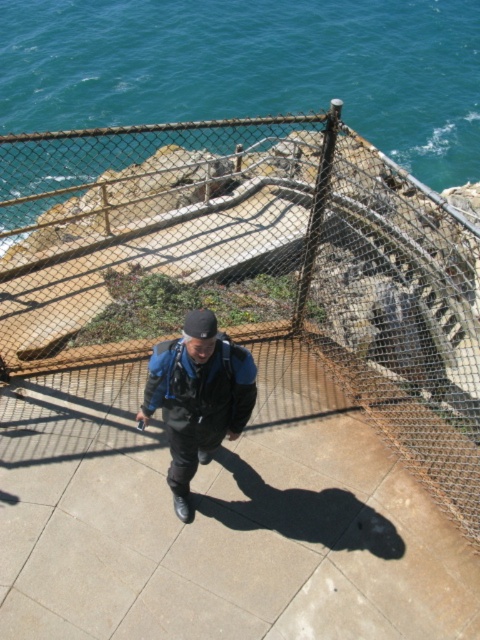
Is rusty wire mesh at center closer to the viewer compared to black matte jacket at center?

No.

Find the location of a particular element. Image resolution: width=480 pixels, height=640 pixels. rusty wire mesh at center is located at coordinates (242, 285).

Is teal water at upper left further to the viewer compared to black matte jacket at center?

Yes, teal water at upper left is behind black matte jacket at center.

Between teal water at upper left and black matte jacket at center, which one appears on the right side from the viewer's perspective?

black matte jacket at center is more to the right.

Locate an element on the screen. This screenshot has height=640, width=480. teal water at upper left is located at coordinates (252, 68).

Where is `teal water at upper left`? teal water at upper left is located at coordinates (252, 68).

Looking at this image, between rusty wire mesh at center and teal water at upper left, which one appears on the right side from the viewer's perspective?

From the viewer's perspective, rusty wire mesh at center appears more on the right side.

Can you confirm if rusty wire mesh at center is shorter than teal water at upper left?

Yes.

This screenshot has width=480, height=640. I want to click on rusty wire mesh at center, so click(242, 285).

This screenshot has height=640, width=480. Find the location of `rusty wire mesh at center`. rusty wire mesh at center is located at coordinates (242, 285).